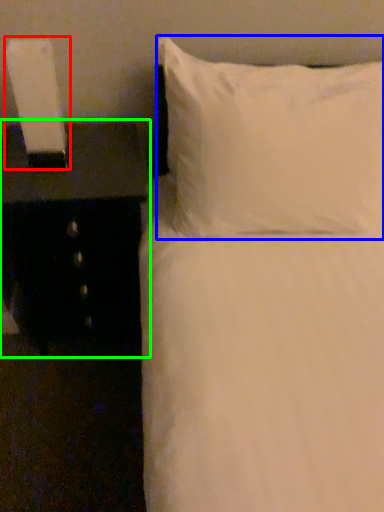
Question: Based on their relative distances, which object is nearer to bedside lamp (highlighted by a red box)? Choose from pillow (highlighted by a blue box) and nightstand (highlighted by a green box).

Choices:
 (A) pillow
 (B) nightstand

Answer: (B)